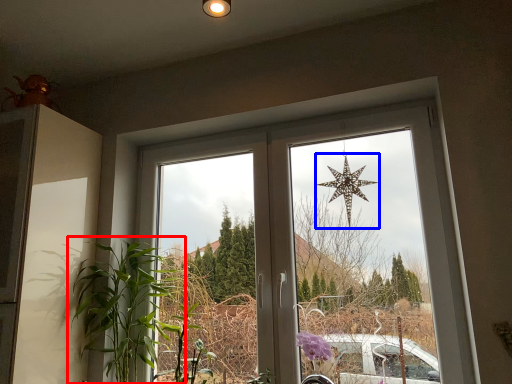
Question: Which object is further to the camera taking this photo, houseplant (highlighted by a red box) or star (highlighted by a blue box)?

Choices:
 (A) houseplant
 (B) star

Answer: (B)